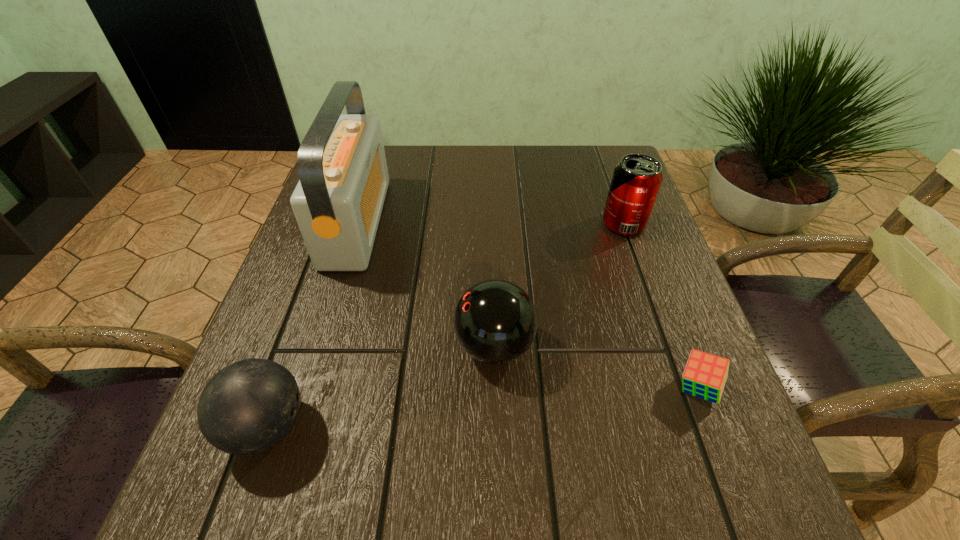
This screenshot has height=540, width=960. Identify the location of blank space located on the surface of the farther bowling ball near the finger holes. (305, 346).

Locate an element on the screen. This screenshot has height=540, width=960. free point located 0.230m on the grip area of the nearer bowling ball is located at coordinates (463, 427).

Find the location of a particular element. Image resolution: width=960 pixels, height=540 pixels. vacant area situated 0.380m on the back of the cube is located at coordinates (635, 224).

Where is `object that is at the far edge`? The height and width of the screenshot is (540, 960). object that is at the far edge is located at coordinates (338, 201).

Locate an element on the screen. object located in the near edge section of the desktop is located at coordinates (249, 406).

Locate an element on the screen. radio receiver present at the left edge is located at coordinates (338, 201).

Identify the location of bowling ball located in the left edge section of the desktop. The height and width of the screenshot is (540, 960). (249, 406).

This screenshot has height=540, width=960. In order to click on soda can situated at the right edge in this screenshot , I will do `click(636, 180)`.

This screenshot has height=540, width=960. I want to click on cube at the right edge, so click(705, 375).

Identify the location of object present at the far left corner. The height and width of the screenshot is (540, 960). (338, 201).